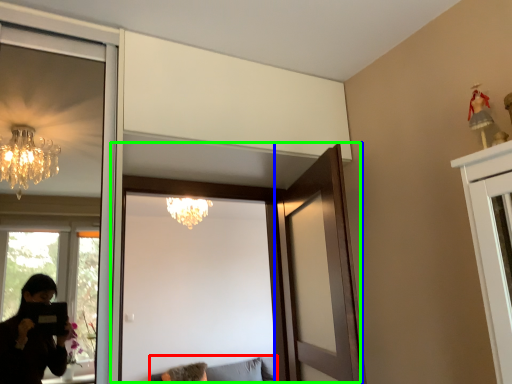
Question: Estimate the real-world distances between objects in this image. Which object is farther from furniture (highlighted by a red box), door (highlighted by a blue box) or door (highlighted by a green box)?

Choices:
 (A) door
 (B) door

Answer: (A)